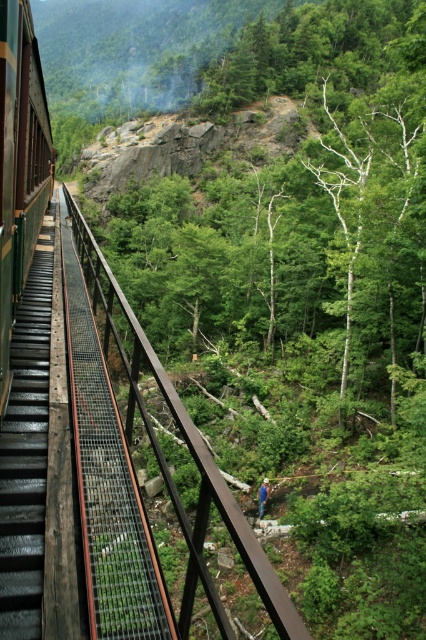
You are a passenger sitting in the train and looking out the window. You see the brown metal rail at center and the blue denim jeans at center. Which object is closer to you?

The brown metal rail at center is closer to you than the blue denim jeans at center.